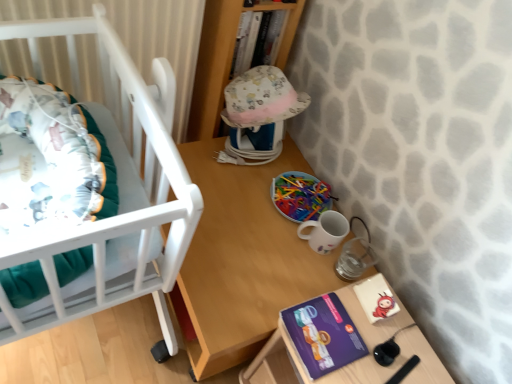
Find the location of a particular element. The image size is (512, 384). spots to the right of purple matte paperback book at lower right is located at coordinates (388, 349).